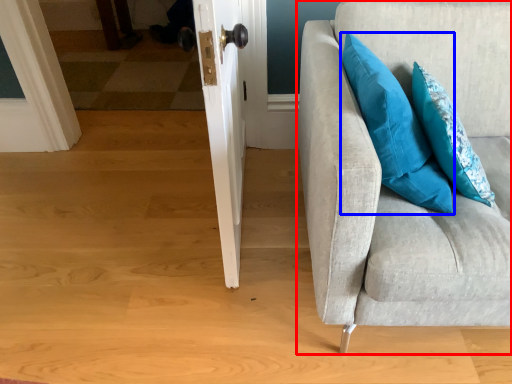
Question: Which object appears farthest to the camera in this image, studio couch (highlighted by a red box) or pillow (highlighted by a blue box)?

Choices:
 (A) studio couch
 (B) pillow

Answer: (B)